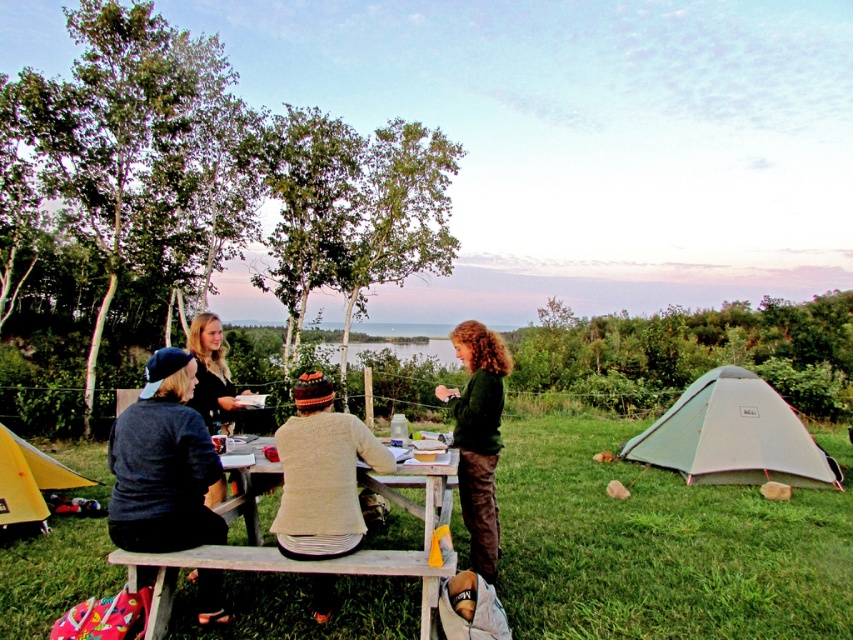
You are standing at the picnic table and want to hand a snack to the person wearing the dark green sweater at center without disturbing the person in the black fabric shirt at center. Which direction should you approach from?

The dark green sweater at center is positioned on the right side of the black fabric shirt at center, so you should approach from the left side of the black fabric shirt at center to avoid disturbing them.

You are trying to decide which sweater to take for a cooler evening. Both the knitted beige sweater at center and the dark green sweater at center are available. Based on their sizes, which one might be more suitable if you prefer a snugger fit?

The knitted beige sweater at center has a lesser height compared to the dark green sweater at center, so it might be more suitable for a snugger fit since it is shorter in length.